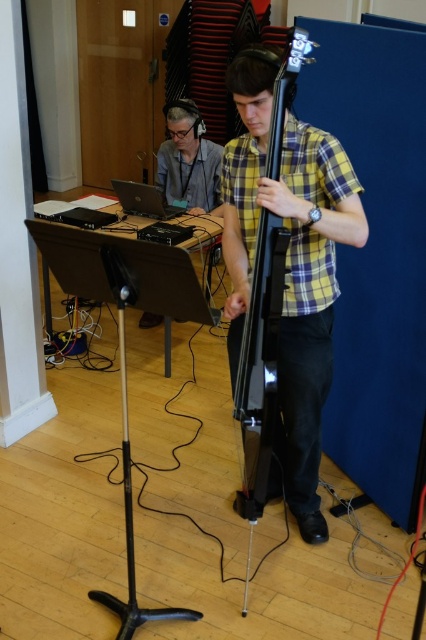
You are a photographer setting up for a music session in the described room. You need to position a light source between the glossy black bass guitar at center and the matte gray headphones at upper left. Based on their positions, where should you place the light source?

The glossy black bass guitar at center is to the right of the matte gray headphones at upper left, so the light source should be placed between them, to the right of the matte gray headphones at upper left and to the left of the glossy black bass guitar at center.

You are a sound engineer in a music studio. You need to place a microphone stand that is 5 feet tall between the glossy black bass guitar at center and the matte gray headphones at upper left. Will the microphone stand fit in the space between them?

The distance between the glossy black bass guitar at center and the matte gray headphones at upper left is 5.73 feet. Since the microphone stand is 5 feet tall, it will fit in the space between them as the available space is larger than the stand.

You are a photographer setting up for a music session. You need to position your camera so that it captures the glossy black bass guitar at center clearly. Given that the camera is placed at point 0.5, 0.5, will the bass guitar be in the center of your frame?

The glossy black bass guitar at center is positioned at point (259, 355), which is slightly to the right and above the camera position at (213, 320). Therefore, the bass guitar will not be perfectly centered in the frame but will appear slightly off to the right and upper side.